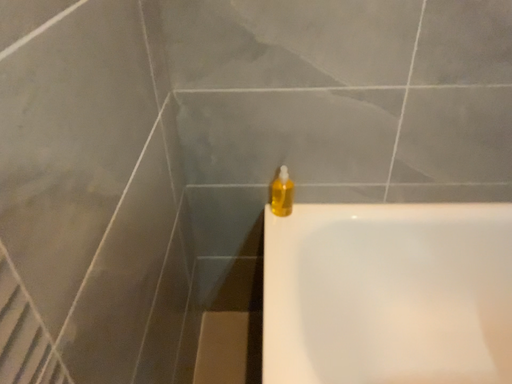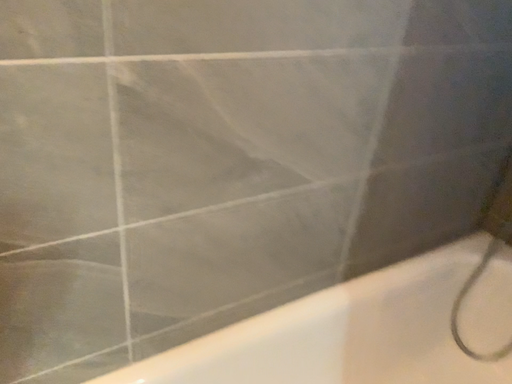
Question: Which way did the camera rotate in the video?

Choices:
 (A) rotated right
 (B) rotated left

Answer: (A)